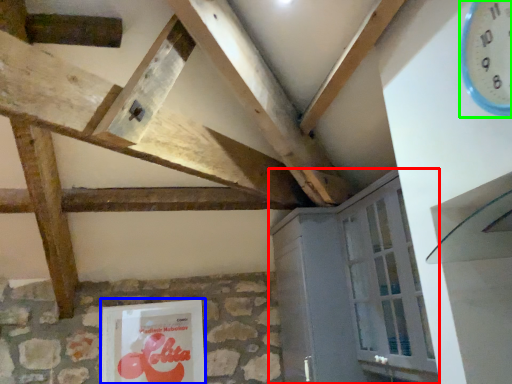
Question: Considering the real-world distances, which object is farthest from cabinetry (highlighted by a red box)? picture frame (highlighted by a blue box) or clock (highlighted by a green box)?

Choices:
 (A) picture frame
 (B) clock

Answer: (B)